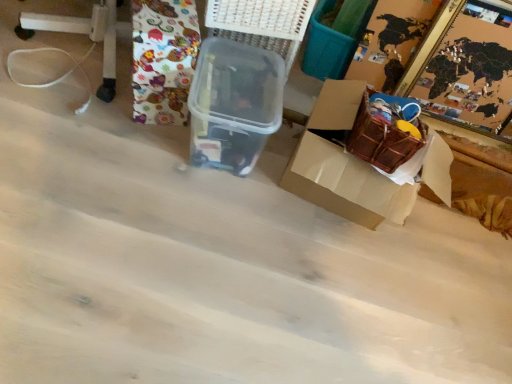
Identify the location of vacant space in front of transparent plastic container at center. (187, 206).